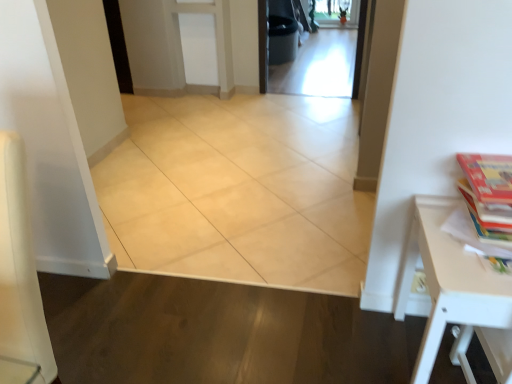
Where is `free spot to the left of white matte table at right`? free spot to the left of white matte table at right is located at coordinates (342, 343).